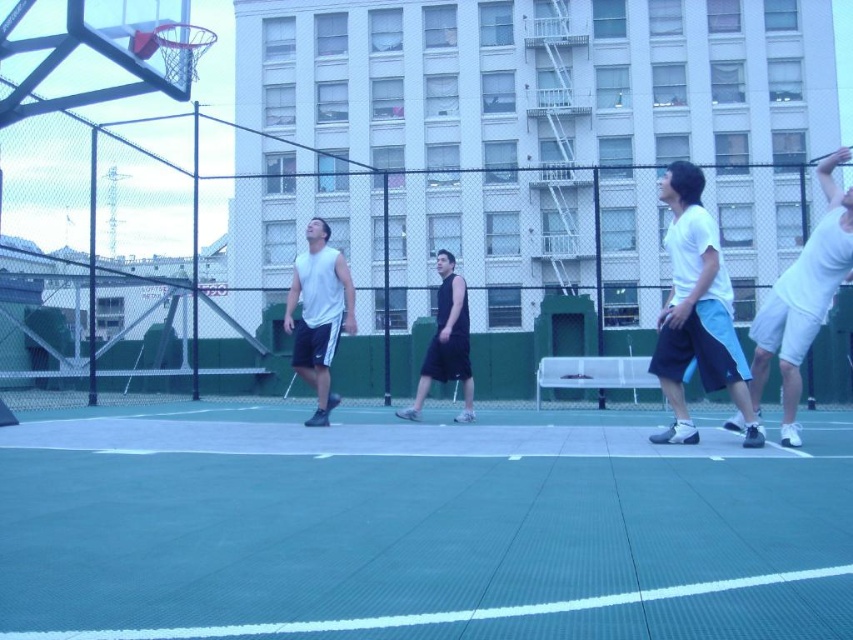
You are standing at the point with coordinates point (114,84) and want to throw a basketball to a teammate standing at point (824,220). Considering the spatial relationship between these two points, will your throw need to go over or under any part of the basketball hoop located on the left side of the frame?

Point (114,84) is behind point (824,220), so the throw from point (114,84) to point (824,220) would need to go over the basketball hoop located on the left side of the frame to reach the teammate.

You are a photographer trying to capture a wide shot of the basketball court. Given that the green rubber court at center is larger than the black sleeveless shirt at center, which object should you focus on to ensure the entire scene is captured properly?

Since the green rubber court at center is larger than the black sleeveless shirt at center, you should focus on capturing the green rubber court at center to ensure the entire scene is included in the photograph.

You are standing at the point with coordinates (416, 529) on the basketball court. What surface are you currently standing on?

You are standing on the green rubber court at center.